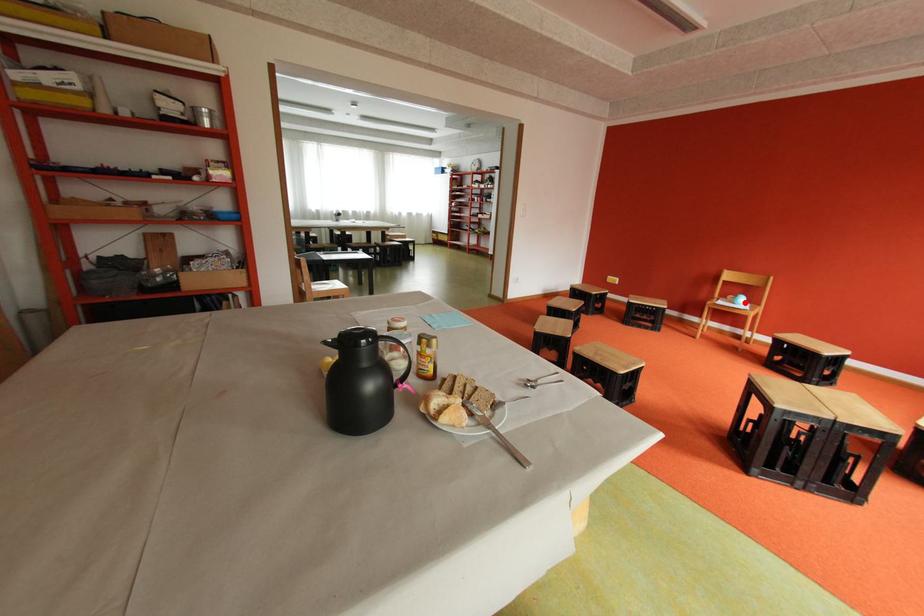
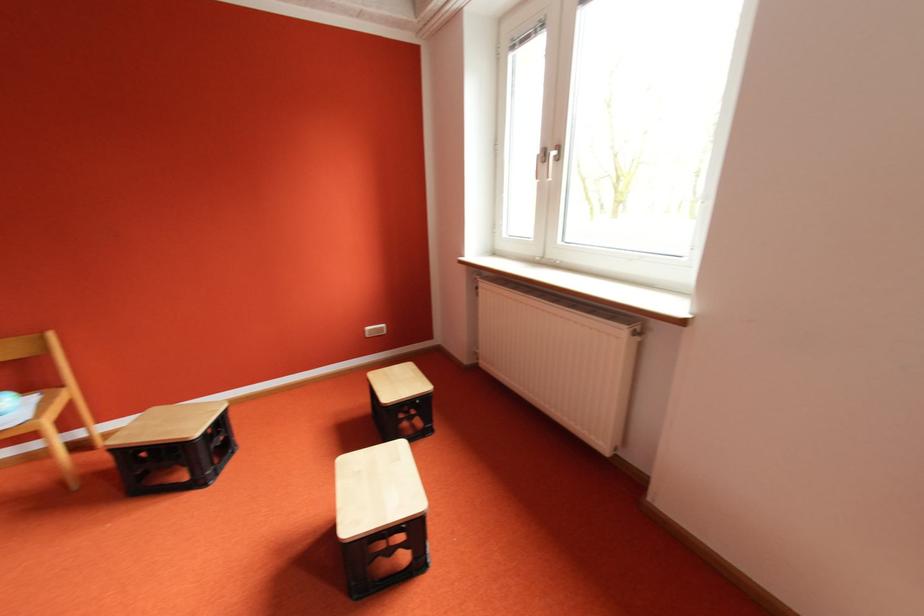
The point at the highlighted location is marked in the first image. Where is the corresponding point in the second image?

(5, 413)